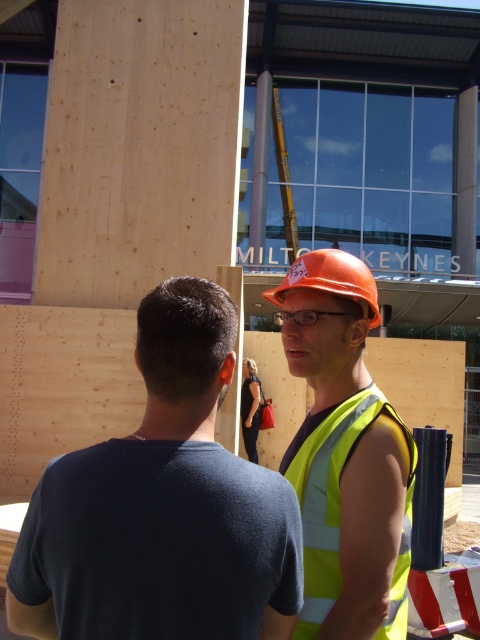
Question: Considering the real-world distances, which object is closest to the dark blue t-shirt at center?

Choices:
 (A) clear plastic goggles at center
 (B) orange hard hat at center

Answer: (B)

Question: Is dark blue t-shirt at center to the right of yellow reflective safety vest at center from the viewer's perspective?

Choices:
 (A) no
 (B) yes

Answer: (A)

Question: Which point is closer to the camera?

Choices:
 (A) orange hard hat at center
 (B) yellow reflective safety vest at center

Answer: (B)

Question: Is dark blue t-shirt at center below clear plastic goggles at center?

Choices:
 (A) yes
 (B) no

Answer: (A)

Question: Is dark blue t-shirt at center further to the viewer compared to orange hard hat at center?

Choices:
 (A) no
 (B) yes

Answer: (A)

Question: Which point is closer to the camera?

Choices:
 (A) clear plastic goggles at center
 (B) orange hard hat at center

Answer: (B)